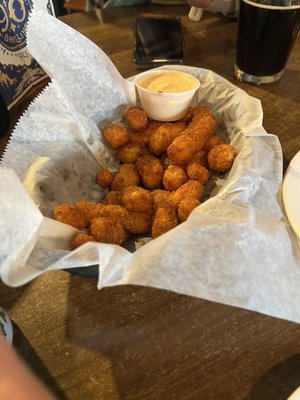
Image resolution: width=300 pixels, height=400 pixels. What are the coordinates of `cup` in the screenshot? It's located at (262, 28).